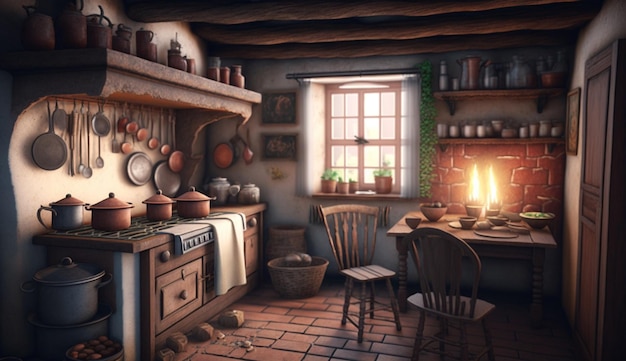
Identify the location of brick floor. (300, 330).